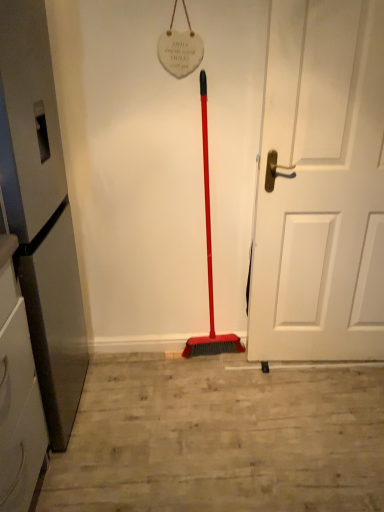
You are a GUI agent. You are given a task and a screenshot of the screen. Output one action in this format:
    pyautogui.click(x=<x>, y=<y>)
    Task: Click on the vacant region below white matte door at center (from a real-world perspective)
    This screenshot has width=384, height=512.
    Given the screenshot: What is the action you would take?
    pyautogui.click(x=314, y=366)